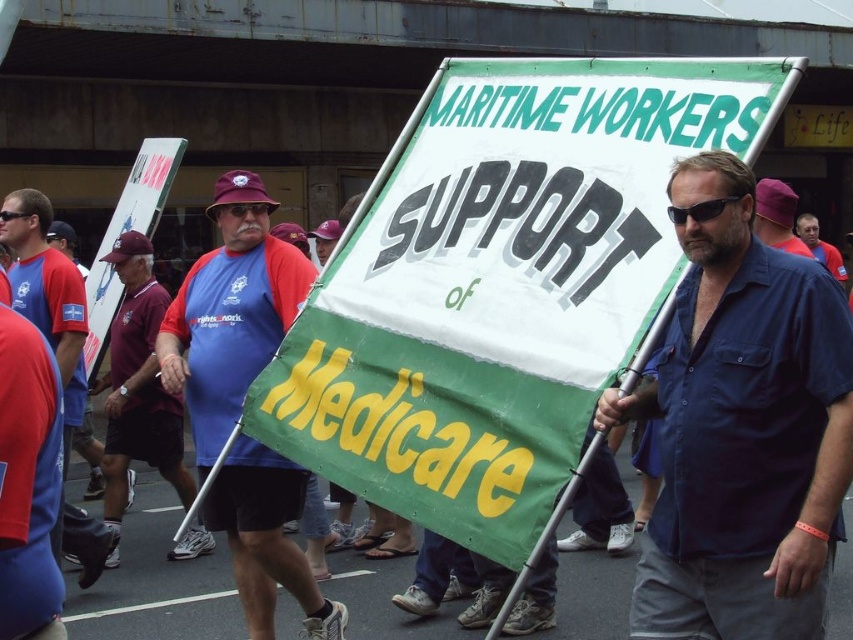
You are a photographer taking a picture of the demonstration. You notice two points in the scene at coordinates point (804,385) and point (189,474). Which point is closer to your camera lens?

Point (804,385) is closer to the viewer than point (189,474).